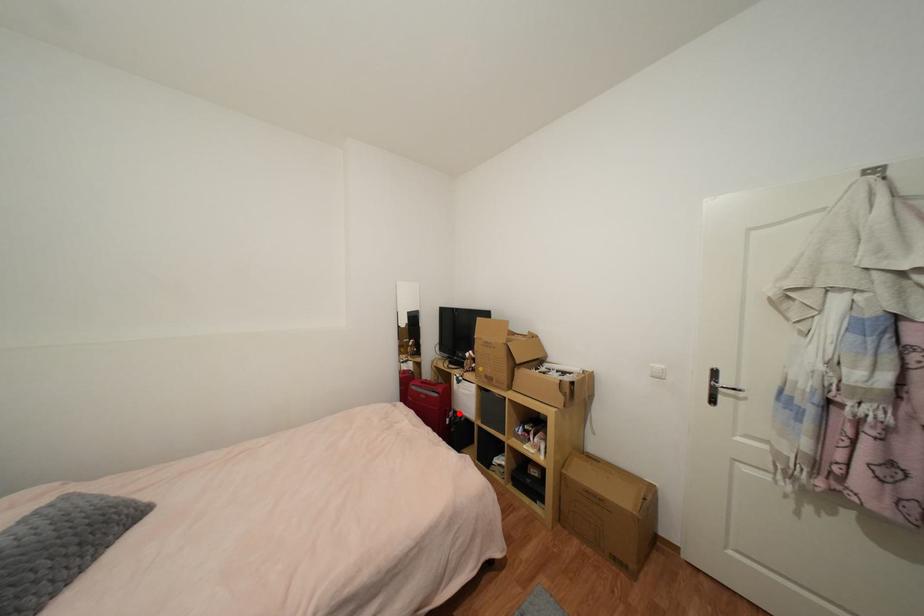
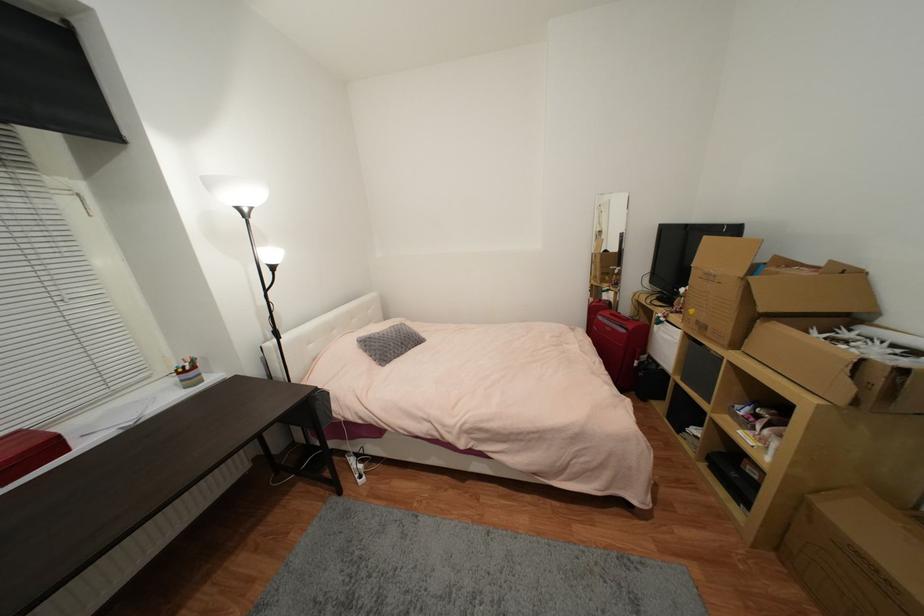
Locate, in the second image, the point that corresponds to the highlighted location in the first image.

(653, 359)